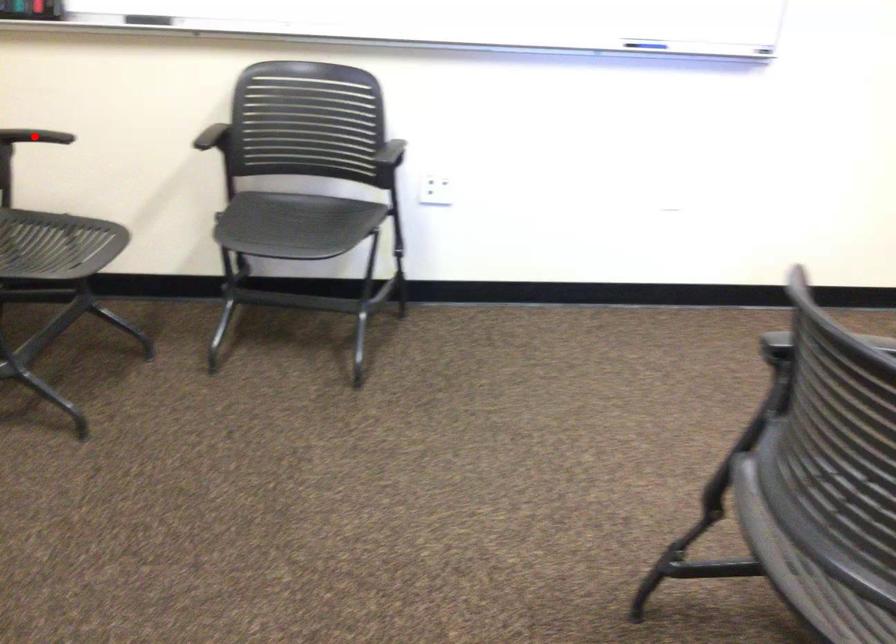
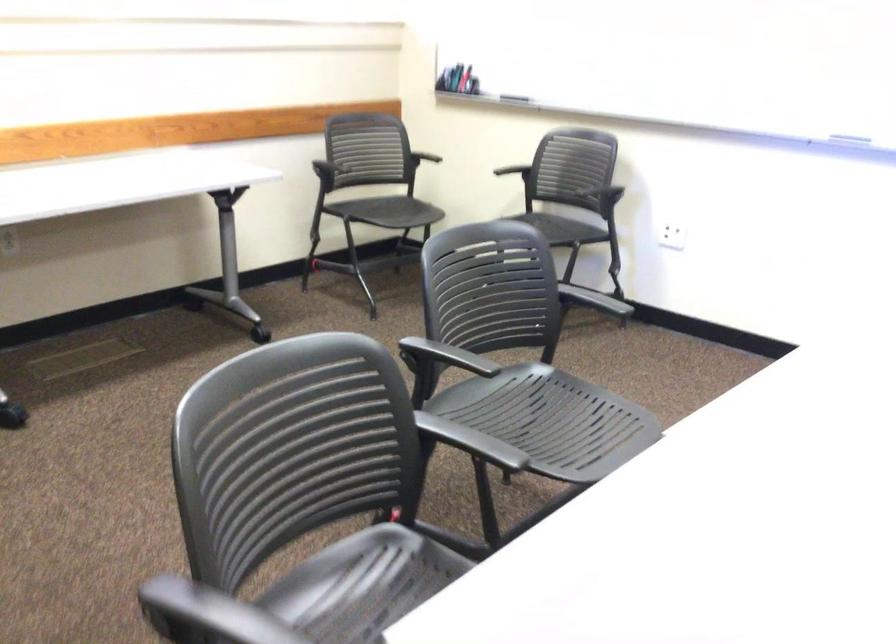
Question: I am providing you with two images of the same scene from different viewpoints. A red point is marked on the first image. Can you still see the location of the red point in image 2?

Choices:
 (A) Yes
 (B) No

Answer: (B)